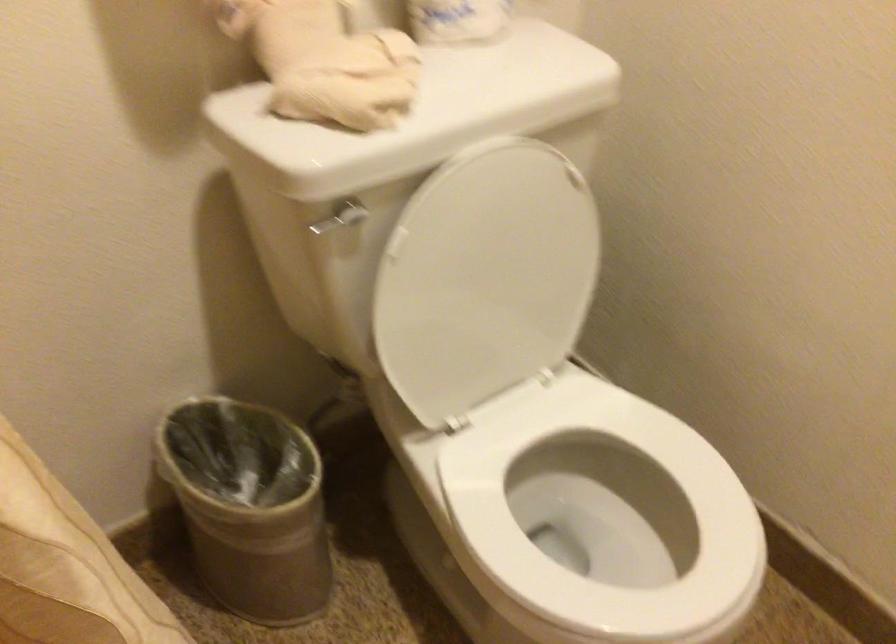
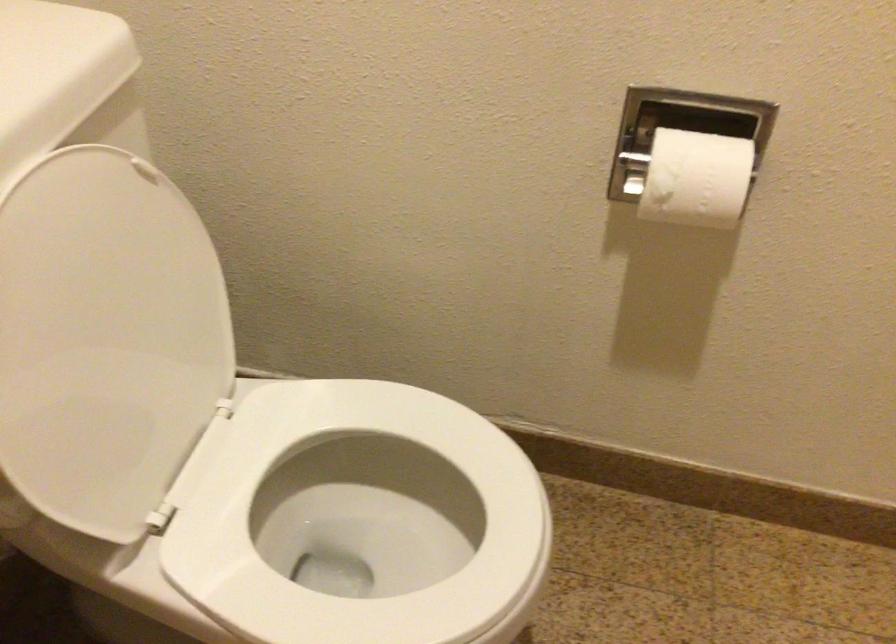
In the second image, find the point that corresponds to (x=481, y=278) in the first image.

(105, 339)